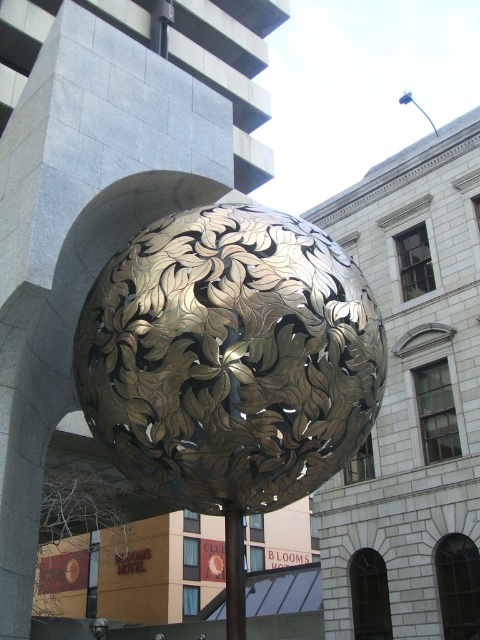
Question: Among these objects, which one is farthest from the camera?

Choices:
 (A) gold metallic pole at center
 (B) gold metallic sphere at center

Answer: (A)

Question: Is the position of gold metallic sphere at center less distant than that of gold metallic pole at center?

Choices:
 (A) no
 (B) yes

Answer: (B)

Question: Does gold metallic sphere at center appear over gold metallic pole at center?

Choices:
 (A) no
 (B) yes

Answer: (B)

Question: Which point is farther to the camera?

Choices:
 (A) gold metallic pole at center
 (B) gold metallic sphere at center

Answer: (A)

Question: Does gold metallic sphere at center lie behind gold metallic pole at center?

Choices:
 (A) yes
 (B) no

Answer: (B)